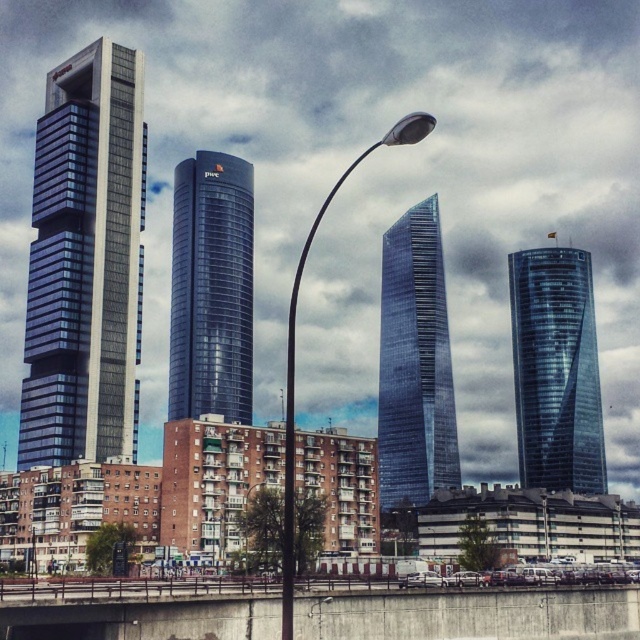
You are a delivery drone that needs to fly from the glossy metal street light at center to the glossy glass tower at center. What is the minimum horizontal distance you need to cover?

The minimum horizontal distance you need to cover is 44.26 meters between the glossy metal street light at center and the glossy glass tower at center.

You are a city planner reviewing this area. You need to install a new security camera on the glossy metal street light at center. However, the camera must have a clear view of the glossy glass tower at center. Is this possible given their positions?

The glossy metal street light at center is behind the glossy glass tower at center, so installing a security camera on the glossy metal street light at center would not allow a clear view of the glossy glass tower at center since the tower is in front of it.

Based on the photo, you are standing on the sidewalk looking at the city skyline. You see a glossy glass tower at center and a glossy metal street light at center. Which object is positioned to the left of the other?

The glossy glass tower at center is positioned to the left of the glossy metal street light at center.